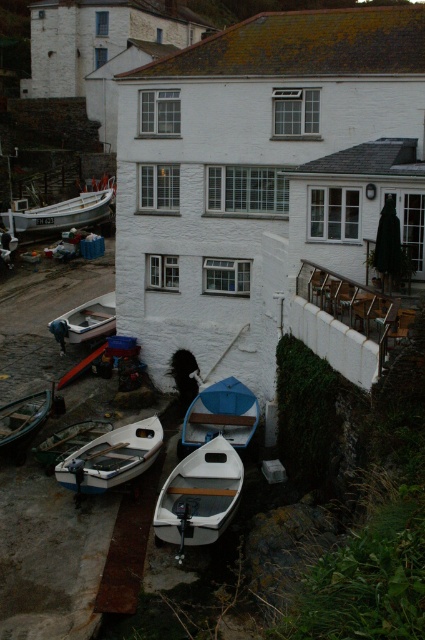
Consider the image. Is white matte boat at center below white wooden boat at center?

Yes, white matte boat at center is below white wooden boat at center.

Locate an element on the screen. The height and width of the screenshot is (640, 425). white matte boat at center is located at coordinates (200, 496).

Locate an element on the screen. The height and width of the screenshot is (640, 425). white matte boat at center is located at coordinates (200, 496).

Where is `white matte boat at center`? The height and width of the screenshot is (640, 425). white matte boat at center is located at coordinates (200, 496).

Does point (200, 444) come closer to viewer compared to point (8, 444)?

No, (200, 444) is behind (8, 444).

Image resolution: width=425 pixels, height=640 pixels. Describe the element at coordinates (220, 416) in the screenshot. I see `blue matte boat at center` at that location.

Locate an element on the screen. This screenshot has height=640, width=425. blue matte boat at center is located at coordinates (220, 416).

Which of these two, white matte boat at lower left or white wooden boat at center, stands taller?

white matte boat at lower left

Which is behind, point (102, 476) or point (99, 301)?

Point (99, 301)

Where is `white matte boat at lower left`? Image resolution: width=425 pixels, height=640 pixels. white matte boat at lower left is located at coordinates (112, 458).